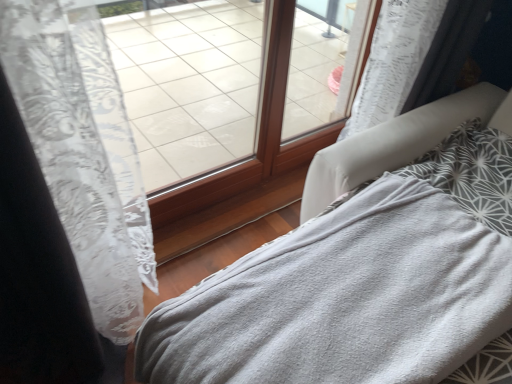
Question: Is gray soft blanket at lower right inside or outside of transparent glass window at center, placed as the second window when sorted from right to left?

Choices:
 (A) outside
 (B) inside

Answer: (A)

Question: From the image's perspective, is gray soft blanket at lower right above or below transparent glass window at center, placed as the second window when sorted from right to left?

Choices:
 (A) below
 (B) above

Answer: (A)

Question: Which object is positioned farthest from the gray soft blanket at lower right?

Choices:
 (A) transparent glass window at center, acting as the first window starting from the left
 (B) transparent glass window at center, the 2th window from the left

Answer: (B)

Question: Which is nearer to the transparent glass window at center, the 2th window from the left?

Choices:
 (A) gray soft blanket at lower right
 (B) transparent glass window at center, acting as the first window starting from the left

Answer: (B)